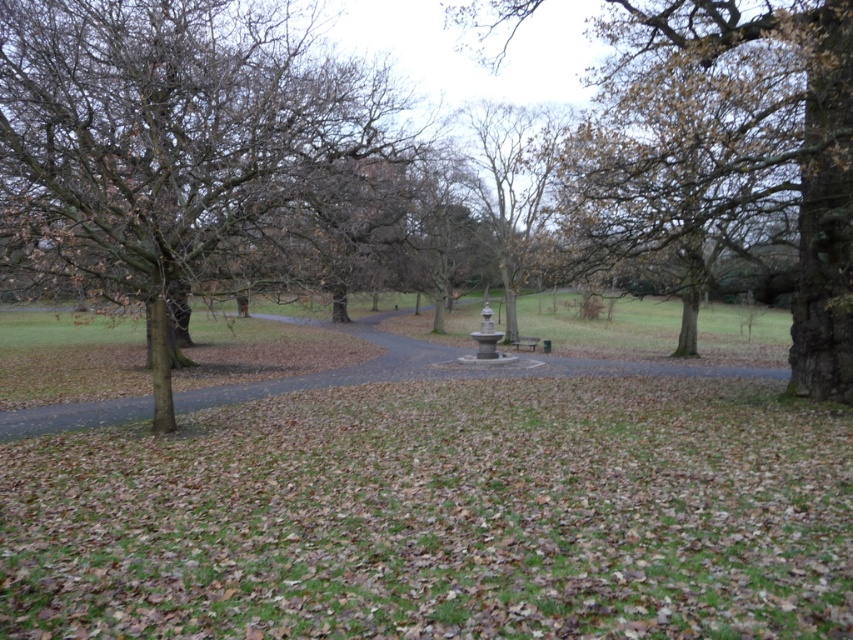
The image size is (853, 640). Describe the element at coordinates (187, 150) in the screenshot. I see `brown leafy tree at center` at that location.

In the scene shown: Is brown leafy tree at center to the right of smooth gray stone fountain at center from the viewer's perspective?

In fact, brown leafy tree at center is to the left of smooth gray stone fountain at center.

Who is more forward, (183, 280) or (563, 116)?

Positioned in front is point (183, 280).

Identify the location of brown leafy tree at center. This screenshot has width=853, height=640. (187, 150).

Can you confirm if brown leafy tree at center is bigger than gravel path at center?

Indeed, brown leafy tree at center has a larger size compared to gravel path at center.

Can you confirm if brown leafy tree at center is positioned below gravel path at center?

Actually, brown leafy tree at center is above gravel path at center.

Who is more forward, (167, 68) or (408, 365)?

Point (167, 68) is in front.

Image resolution: width=853 pixels, height=640 pixels. I want to click on brown leafy tree at center, so click(x=187, y=150).

Is gravel path at center shorter than smooth gray stone fountain at center?

Yes.

Does gravel path at center have a greater height compared to smooth gray stone fountain at center?

Incorrect, gravel path at center's height is not larger of smooth gray stone fountain at center's.

Does point (409, 376) lie in front of point (512, 124)?

Yes.

Locate an element on the screen. The width and height of the screenshot is (853, 640). gravel path at center is located at coordinates [x=438, y=365].